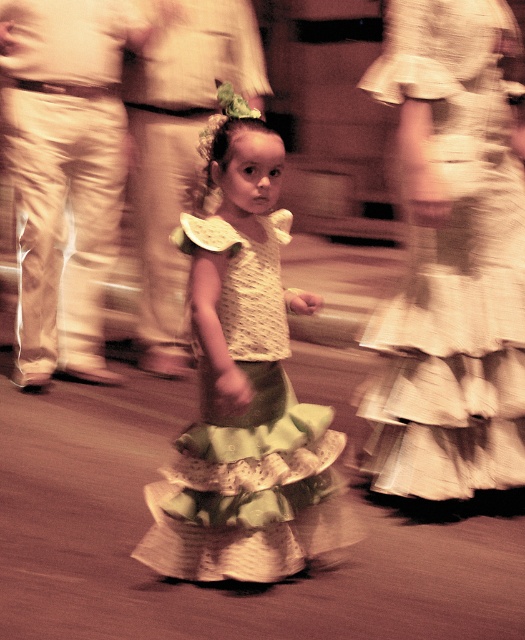
Question: Does green ruffled skirt at center appear on the left side of green textured skirt at center?

Choices:
 (A) no
 (B) yes

Answer: (A)

Question: Which object is farther from the camera taking this photo?

Choices:
 (A) green textured skirt at center
 (B) green ruffled skirt at center

Answer: (B)

Question: Which point is farther to the camera?

Choices:
 (A) (470, 380)
 (B) (307, 492)

Answer: (A)

Question: Can you confirm if green ruffled skirt at center is thinner than green textured skirt at center?

Choices:
 (A) no
 (B) yes

Answer: (B)

Question: Is green ruffled skirt at center wider than green textured skirt at center?

Choices:
 (A) yes
 (B) no

Answer: (B)